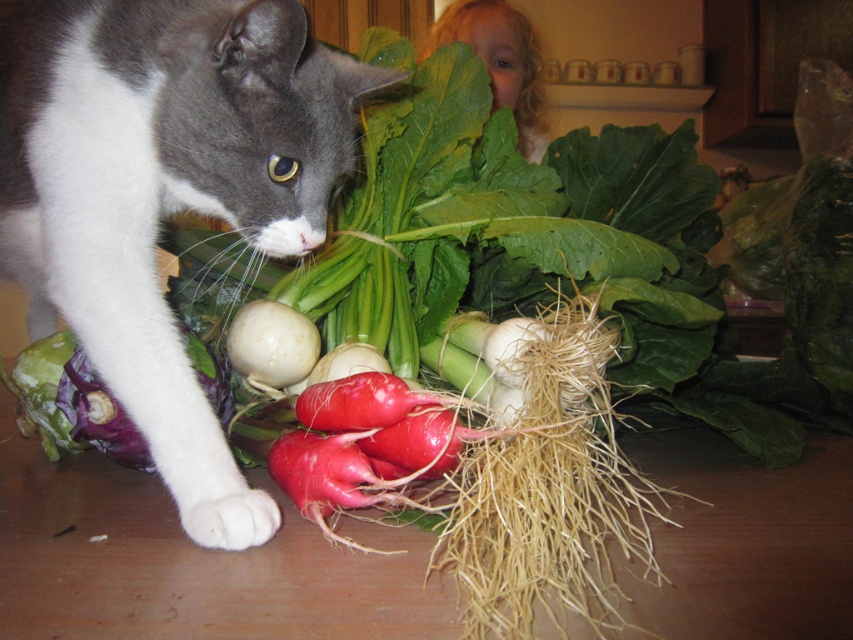
In the scene shown: Does dry straw roots at center have a greater height compared to white matte onion at center?

Yes, dry straw roots at center is taller than white matte onion at center.

Who is more distant from viewer, (485, 618) or (254, 378)?

The point (254, 378) is behind.

Identify the location of dry straw roots at center. (550, 492).

Between gray fur cat at left and dry straw roots at center, which one is positioned lower?

dry straw roots at center is lower down.

Based on the photo, is gray fur cat at left closer to the viewer compared to dry straw roots at center?

No, gray fur cat at left is further to the viewer.

You are a GUI agent. You are given a task and a screenshot of the screen. Output one action in this format:
    pyautogui.click(x=<x>, y=<y>)
    Task: Click on the gray fur cat at left
    This screenshot has height=640, width=853.
    Given the screenshot: What is the action you would take?
    click(x=164, y=192)

The height and width of the screenshot is (640, 853). I want to click on gray fur cat at left, so click(164, 192).

Can you confirm if gray fur cat at left is shorter than white matte onion at center?

In fact, gray fur cat at left may be taller than white matte onion at center.

Is point (265, 193) more distant than point (302, 332)?

No.

Describe the element at coordinates (164, 192) in the screenshot. I see `gray fur cat at left` at that location.

This screenshot has width=853, height=640. What are the coordinates of `gray fur cat at left` in the screenshot? It's located at click(x=164, y=192).